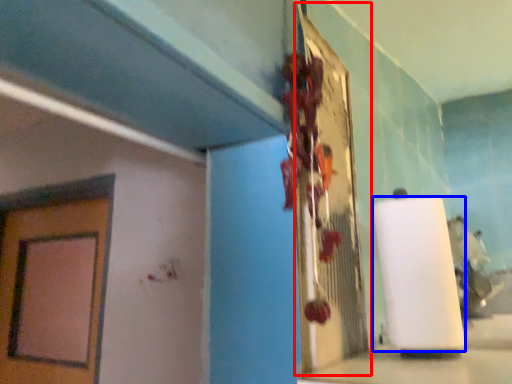
Question: Which object is closer to the camera taking this photo, bulletin board (highlighted by a red box) or paper towel (highlighted by a blue box)?

Choices:
 (A) bulletin board
 (B) paper towel

Answer: (A)